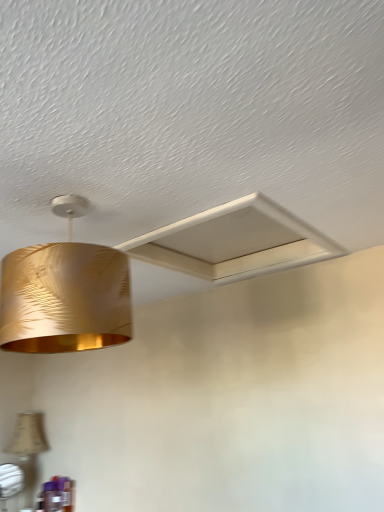
Question: Is beige fabric lampshade at lower left, which is the first lamp in back-to-front order, positioned with its back to gold metallic lampshade at upper left, which appears as the 2th lamp when viewed from the left?

Choices:
 (A) yes
 (B) no

Answer: (B)

Question: Is gold metallic lampshade at upper left, which appears as the 2th lamp when viewed from the left, surrounded by beige fabric lampshade at lower left, the first lamp ordered from the bottom?

Choices:
 (A) no
 (B) yes

Answer: (A)

Question: From the image's perspective, is beige fabric lampshade at lower left, acting as the 2th lamp starting from the right, beneath gold metallic lampshade at upper left, the 1th lamp when ordered from front to back?

Choices:
 (A) yes
 (B) no

Answer: (A)

Question: Is the position of beige fabric lampshade at lower left, placed as the first lamp when sorted from left to right, less distant than that of gold metallic lampshade at upper left, the 1th lamp when ordered from front to back?

Choices:
 (A) yes
 (B) no

Answer: (B)

Question: Does beige fabric lampshade at lower left, placed as the first lamp when sorted from left to right, have a smaller size compared to gold metallic lampshade at upper left, which is the second lamp in bottom-to-top order?

Choices:
 (A) yes
 (B) no

Answer: (A)

Question: Relative to beige fabric lampshade at lower left, which is the first lamp in back-to-front order, is gold metallic lampshade at upper left, which ranks as the second lamp in back-to-front order, in front or behind?

Choices:
 (A) front
 (B) behind

Answer: (A)

Question: Considering the positions of gold metallic lampshade at upper left, which is the second lamp in bottom-to-top order, and beige fabric lampshade at lower left, the first lamp ordered from the bottom, in the image, is gold metallic lampshade at upper left, which is the second lamp in bottom-to-top order, taller or shorter than beige fabric lampshade at lower left, the first lamp ordered from the bottom,?

Choices:
 (A) short
 (B) tall

Answer: (A)

Question: Is gold metallic lampshade at upper left, which is the 1th lamp in top-to-bottom order, bigger or smaller than beige fabric lampshade at lower left, acting as the 2th lamp starting from the right?

Choices:
 (A) small
 (B) big

Answer: (B)

Question: From a real-world perspective, relative to beige fabric lampshade at lower left, the second lamp from the front, is gold metallic lampshade at upper left, which appears as the 2th lamp when viewed from the left, vertically above or below?

Choices:
 (A) above
 (B) below

Answer: (A)

Question: In the image, is gold metallic lampshade at upper left, which is the second lamp in bottom-to-top order, positioned in front of or behind white matte exhaust hood at upper center?

Choices:
 (A) front
 (B) behind

Answer: (A)

Question: From a real-world perspective, is gold metallic lampshade at upper left, which is the second lamp in bottom-to-top order, physically located above or below white matte exhaust hood at upper center?

Choices:
 (A) above
 (B) below

Answer: (B)

Question: From the image's perspective, relative to white matte exhaust hood at upper center, is gold metallic lampshade at upper left, the 1th lamp when ordered from front to back, above or below?

Choices:
 (A) above
 (B) below

Answer: (B)

Question: Is gold metallic lampshade at upper left, the 1th lamp when ordered from front to back, spatially inside white matte exhaust hood at upper center, or outside of it?

Choices:
 (A) inside
 (B) outside

Answer: (B)

Question: From the image's perspective, is beige fabric lampshade at lower left, which is the first lamp in back-to-front order, located above or below white matte exhaust hood at upper center?

Choices:
 (A) below
 (B) above

Answer: (A)

Question: Considering the positions of point (41, 423) and point (236, 258), is point (41, 423) closer or farther from the camera than point (236, 258)?

Choices:
 (A) closer
 (B) farther

Answer: (B)